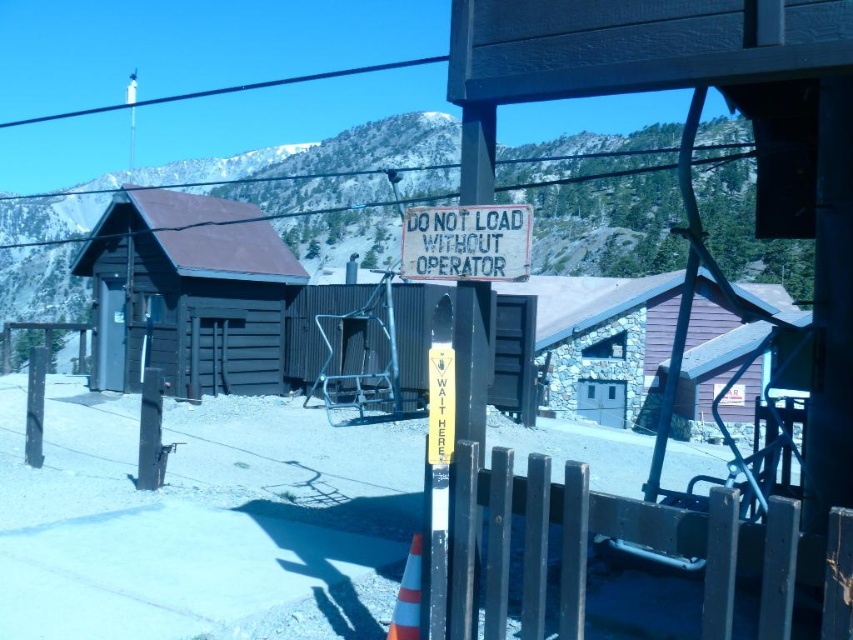
Who is more forward, [155,236] or [397,628]?

Point [397,628] is more forward.

Does point (107, 310) come behind point (405, 563)?

Yes, point (107, 310) is farther from viewer.

Who is more forward, [213,337] or [419,547]?

Point [419,547] is in front.

This screenshot has width=853, height=640. Find the location of `dark brown wooden hut at center`. dark brown wooden hut at center is located at coordinates (189, 292).

Between stone/wooden cabin at center and black wire at upper center, which one appears on the left side from the viewer's perspective?

black wire at upper center

Is point (625, 292) behind point (289, 81)?

That is False.

Is point (599, 324) more distant than point (126, 106)?

No, (599, 324) is in front of (126, 106).

The width and height of the screenshot is (853, 640). Identify the location of stone/wooden cabin at center. (602, 340).

Can you confirm if dark brown wooden hut at center is smaller than white painted wood sign at center?

Indeed, dark brown wooden hut at center has a smaller size compared to white painted wood sign at center.

Can you confirm if dark brown wooden hut at center is shorter than white painted wood sign at center?

Yes, dark brown wooden hut at center is shorter than white painted wood sign at center.

Which is in front, point (236, 390) or point (426, 248)?

Point (426, 248)

The image size is (853, 640). Find the location of `dark brown wooden hut at center`. dark brown wooden hut at center is located at coordinates (189, 292).